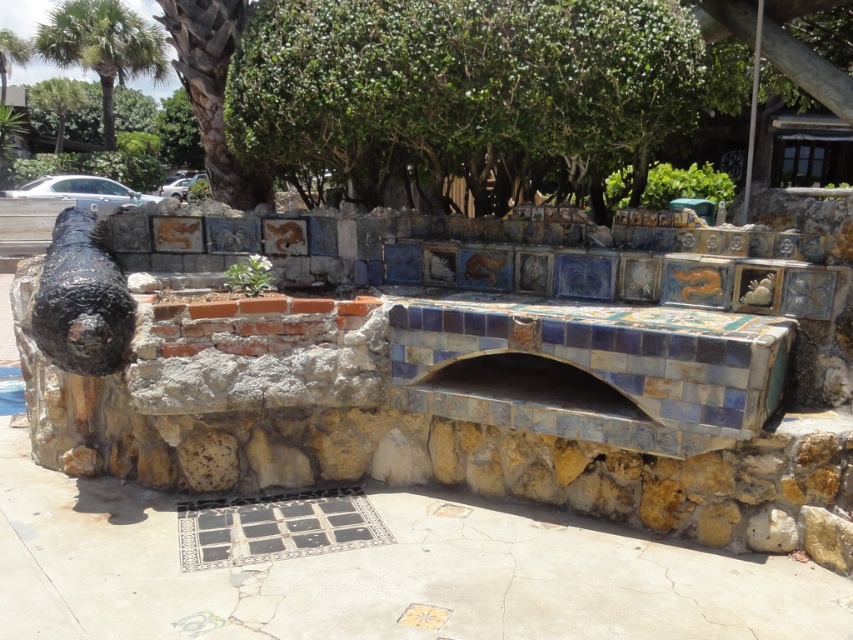
Question: Among these objects, which one is nearest to the camera?

Choices:
 (A) matte ceramic hand at center-right
 (B) rusty metal cannon at left

Answer: (B)

Question: Among these objects, which one is farthest from the camera?

Choices:
 (A) green leafy palm tree at upper left
 (B) matte ceramic hand at center-right

Answer: (A)

Question: Is green leafy palm tree at upper left bigger than matte ceramic hand at center-right?

Choices:
 (A) yes
 (B) no

Answer: (A)

Question: Is rusty metal cannon at left positioned before matte ceramic hand at center-right?

Choices:
 (A) yes
 (B) no

Answer: (A)

Question: Estimate the real-world distances between objects in this image. Which object is closer to the matte ceramic hand at center-right?

Choices:
 (A) rusty metal cannon at left
 (B) green leafy palm tree at upper left

Answer: (A)

Question: Does rusty metal cannon at left have a smaller size compared to green leafy palm tree at upper left?

Choices:
 (A) no
 (B) yes

Answer: (B)